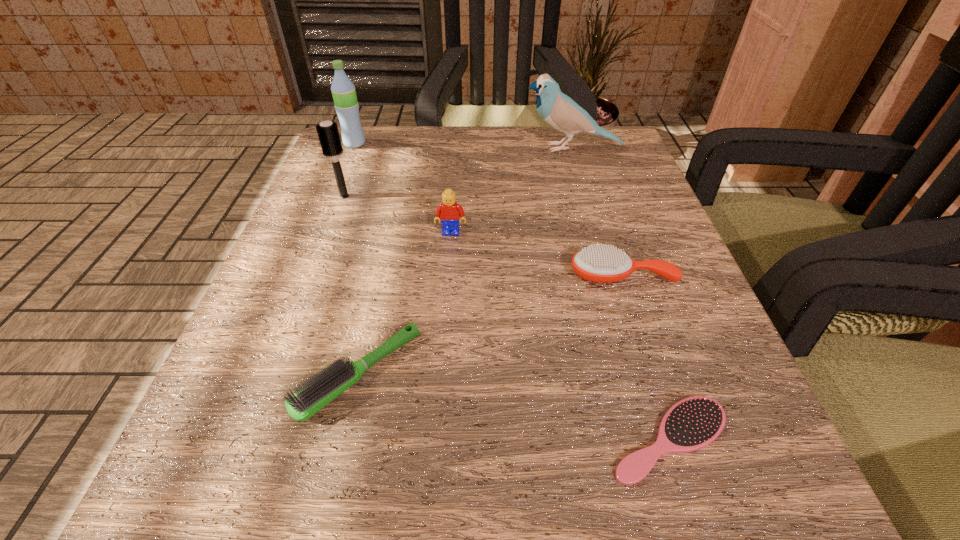
At what (x,y) coordinates should I click in order to perform the action: click on water bottle present at the far edge. Please return your answer as a coordinate pair (x, y). The width and height of the screenshot is (960, 540). Looking at the image, I should click on (346, 105).

You are a GUI agent. You are given a task and a screenshot of the screen. Output one action in this format:
    pyautogui.click(x=<x>, y=<y>)
    Task: Click on the bird positioned at the far edge
    
    Given the screenshot: What is the action you would take?
    pyautogui.click(x=562, y=113)

The image size is (960, 540). I want to click on object at the near edge, so click(x=693, y=423).

Find the location of `water bottle situated at the left edge`. water bottle situated at the left edge is located at coordinates (346, 105).

Locate an element on the screen. bird that is at the right edge is located at coordinates (562, 113).

This screenshot has height=540, width=960. Find the location of `object positioned at the far left corner`. object positioned at the far left corner is located at coordinates (346, 105).

Where is `object that is at the far right corner`? The width and height of the screenshot is (960, 540). object that is at the far right corner is located at coordinates (562, 113).

Find the location of `object at the near right corner`. object at the near right corner is located at coordinates (693, 423).

Image resolution: width=960 pixels, height=540 pixels. I want to click on free space at the far edge, so click(438, 139).

Find the location of a particular element. The image size is (960, 540). free space at the near edge of the desktop is located at coordinates (385, 487).